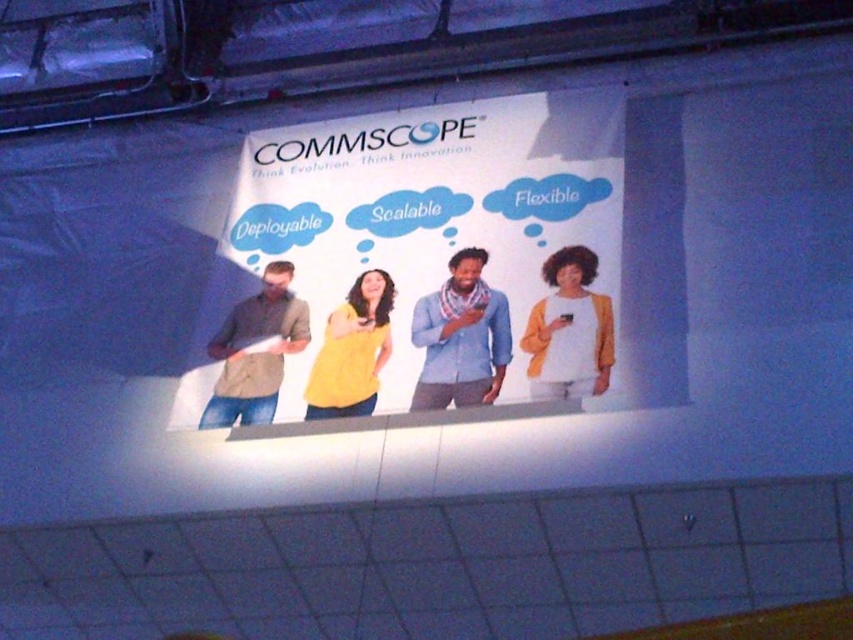
You are a customer at the event and see both the blue cotton shirt at center and the yellow matte shirt at center. Which one is positioned to the right side?

The blue cotton shirt at center is positioned to the right of the yellow matte shirt at center.

You are standing in front of the Commscope promotional banner and want to touch both the point at coordinates point (x=357, y=234) and point (x=438, y=390). Which point will you reach first?

The point at coordinates point (x=357, y=234) is closer to you than point (x=438, y=390), so you will reach it first.

You are an attendee at the Commscope event and you see the white paper at center and the blue cotton shirt at center. Which object is larger in size?

The white paper at center is bigger than the blue cotton shirt at center.